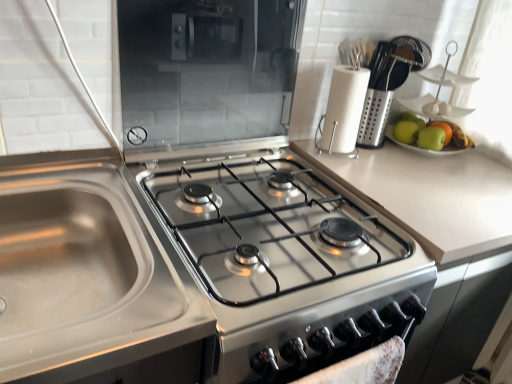
Where is `vacant space to the right of white paper towel at upper right`? The image size is (512, 384). vacant space to the right of white paper towel at upper right is located at coordinates (397, 162).